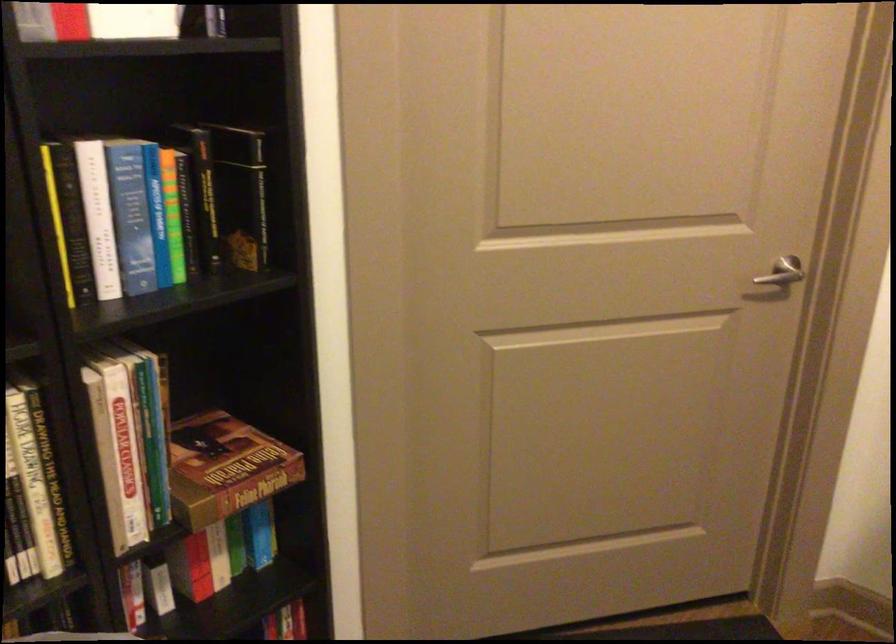
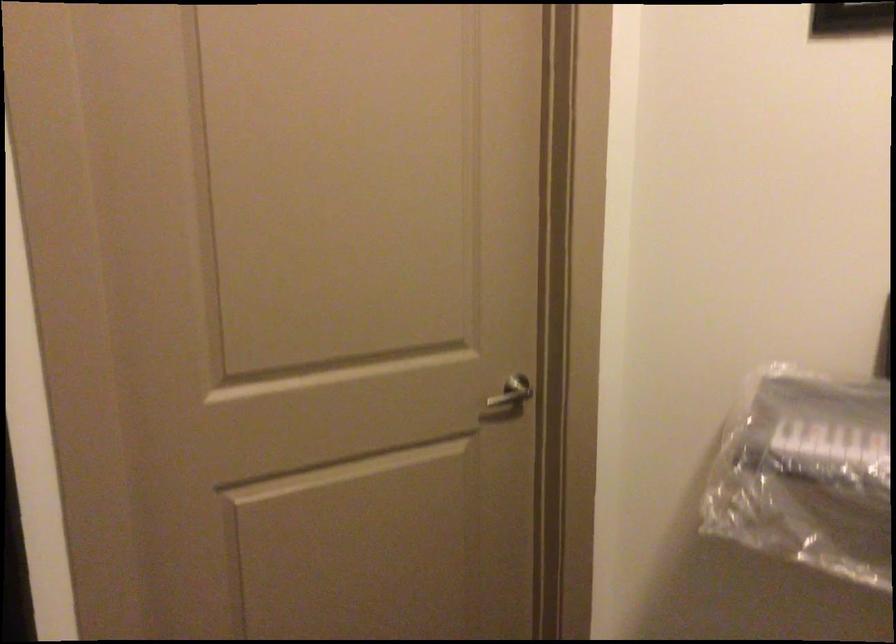
Question: The camera is either moving clockwise (left) or counter-clockwise (right) around the object. The first image is from the beginning of the video and the second image is from the end. Is the camera moving left or right when shooting the video?

Choices:
 (A) Left
 (B) Right

Answer: (A)